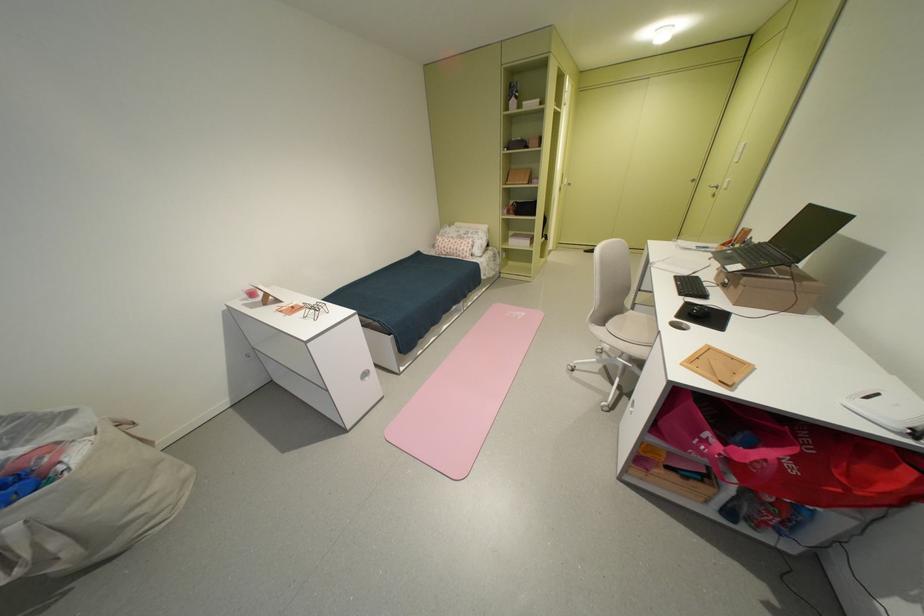
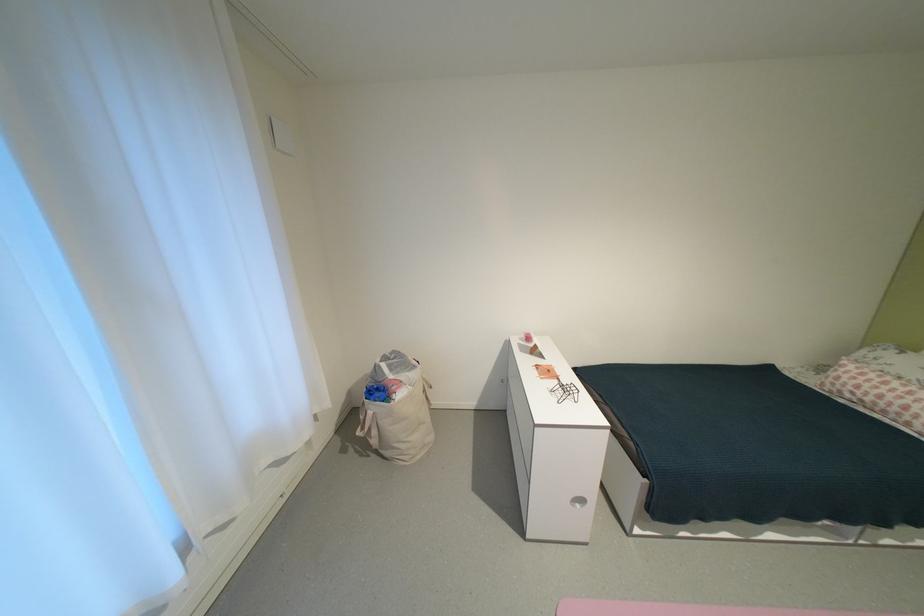
Question: How did the camera likely rotate?

Choices:
 (A) Left
 (B) Right
 (C) Up
 (D) Down

Answer: (A)